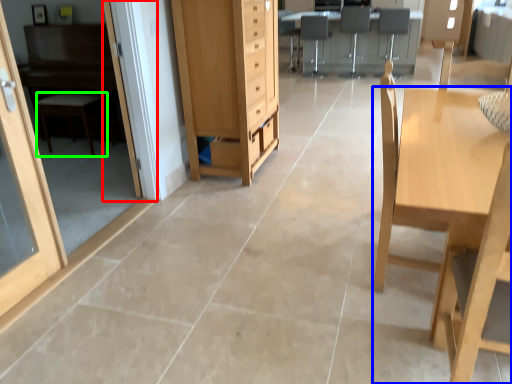
Question: Based on their relative distances, which object is nearer to screen door (highlighted by a red box)? Choose from table (highlighted by a blue box) and furniture (highlighted by a green box).

Choices:
 (A) table
 (B) furniture

Answer: (B)